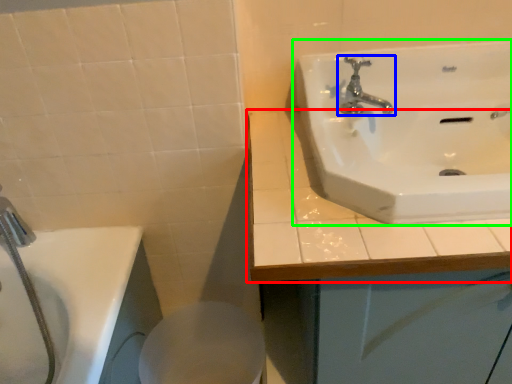
Question: Considering the real-world distances, which object is closest to counter top (highlighted by a red box)? tap (highlighted by a blue box) or sink (highlighted by a green box).

Choices:
 (A) tap
 (B) sink

Answer: (B)